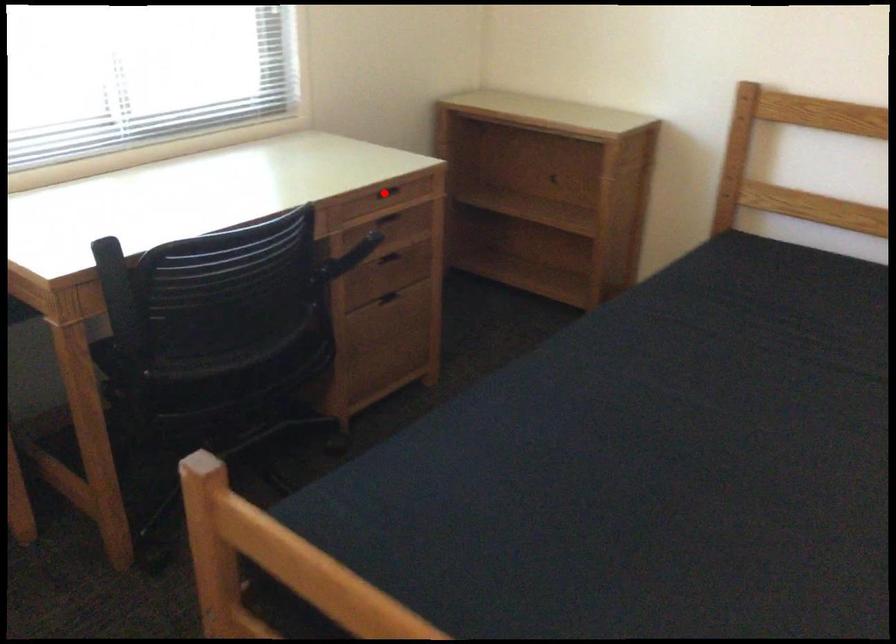
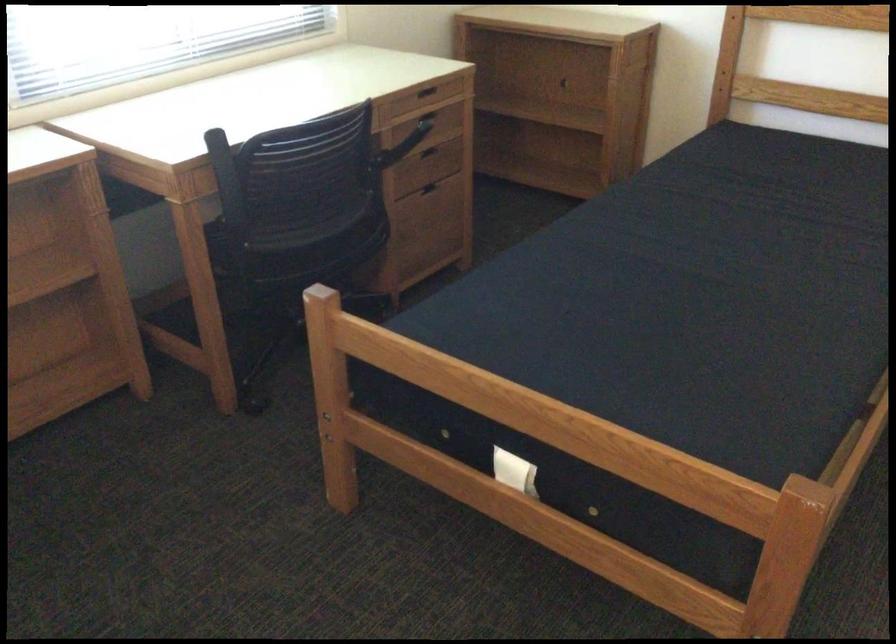
Locate, in the second image, the point that corresponds to the highlighted location in the first image.

(424, 91)